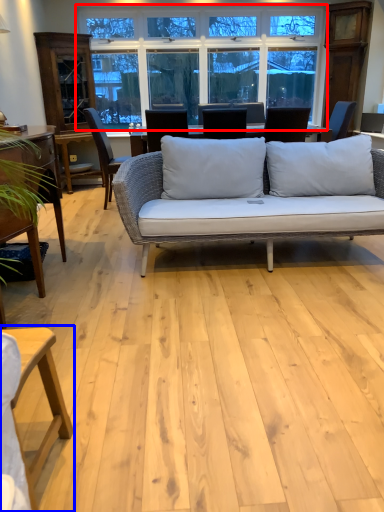
Question: Among these objects, which one is farthest to the camera, window (highlighted by a red box) or table (highlighted by a blue box)?

Choices:
 (A) window
 (B) table

Answer: (A)